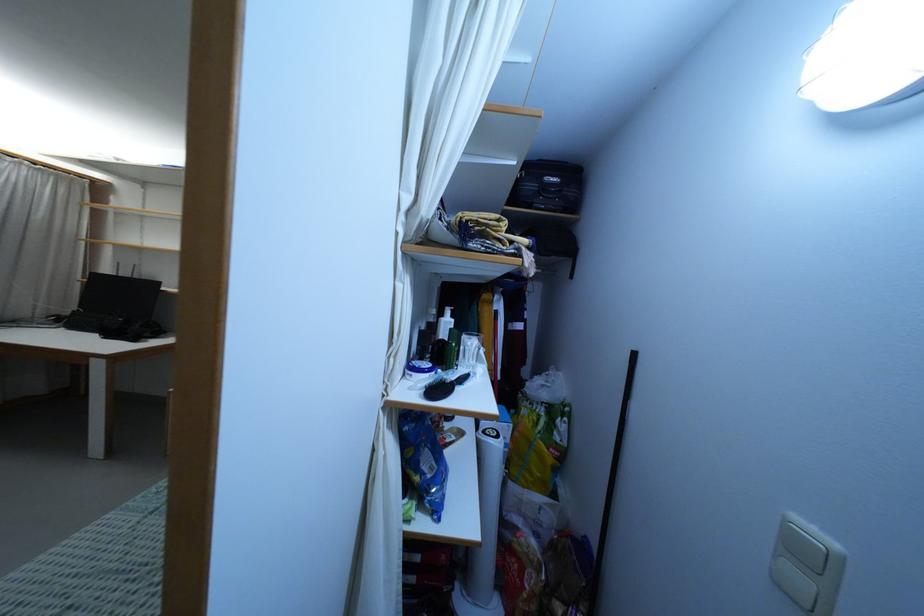
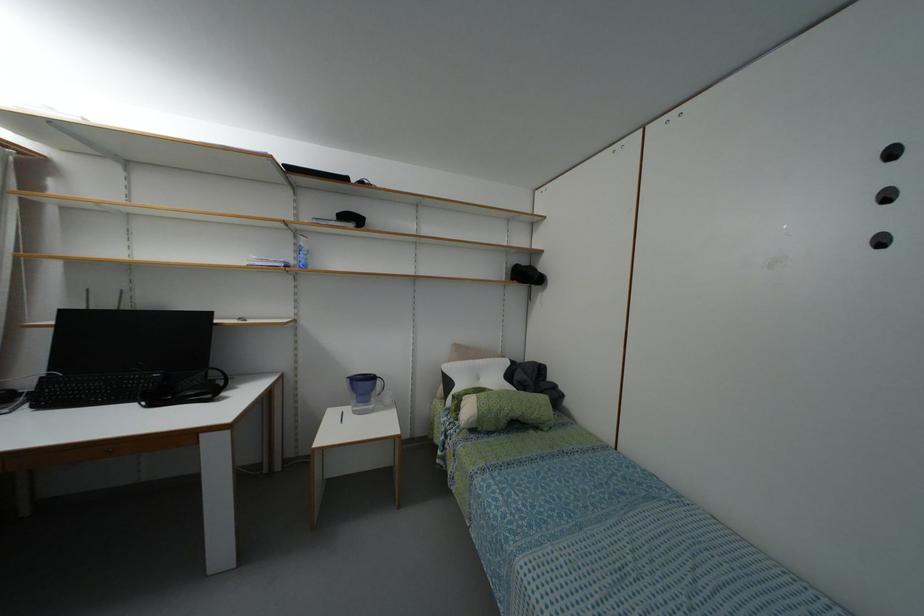
Question: In a continuous first-person perspective shot, in which direction is the camera moving?

Choices:
 (A) Left
 (B) Right
 (C) Forward
 (D) Backward

Answer: (A)